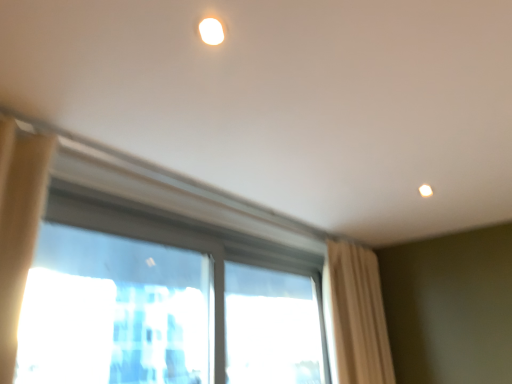
Question: From the image's perspective, relative to transparent glass window at center, is transparent glass window at center, acting as the 1th window starting from the left, above or below?

Choices:
 (A) above
 (B) below

Answer: (B)

Question: In terms of height, does transparent glass window at center, the second window positioned from the right, look taller or shorter compared to transparent glass window at center?

Choices:
 (A) short
 (B) tall

Answer: (A)

Question: Estimate the real-world distances between objects in this image. Which object is farther from the transparent glass window at center, marked as the 2th window in a left-to-right arrangement?

Choices:
 (A) transparent glass window at center, the second window positioned from the right
 (B) transparent glass window at center
 (C) beige fabric curtain at right

Answer: (B)

Question: Considering the real-world distances, which object is farthest from the transparent glass window at center?

Choices:
 (A) transparent glass window at center, acting as the 1th window starting from the right
 (B) beige fabric curtain at right
 (C) transparent glass window at center, the second window positioned from the right

Answer: (B)